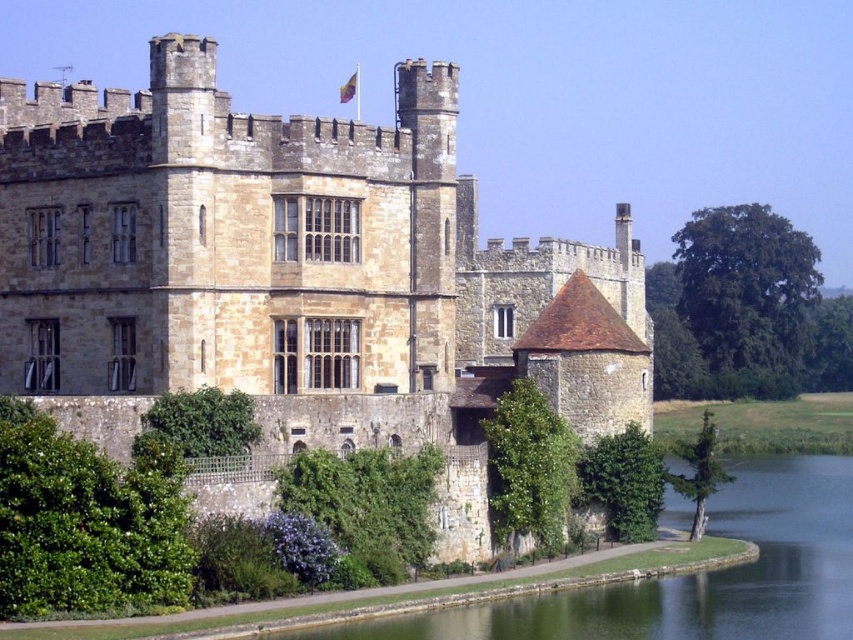
You are a drone operator trying to capture an aerial shot of the brown stone castle at center. The castle is located at point coordinates of 0.431, 0.347. Your drone is currently hovering at point coordinates of 0.5, 0.5. Which direction should you direct the drone to move to reach the castle?

The brown stone castle at center is located at coordinates (294, 275). Since the drone is at (426, 320), it needs to move southwest to reach the castle.

You are a visitor approaching the castle and want to know if the brown stone castle at center is bigger than the green grassy bank at lower center. Based on the scene, can you confirm?

The brown stone castle at center is larger in size than the green grassy bank at lower center according to the description.

You are a visitor approaching the castle and want to know if the brown stone castle at center is wider than the green grassy bank at lower center. Can you determine this based on the scene?

The brown stone castle at center is wider than the green grassy bank at lower center, so yes, the castle is wider.